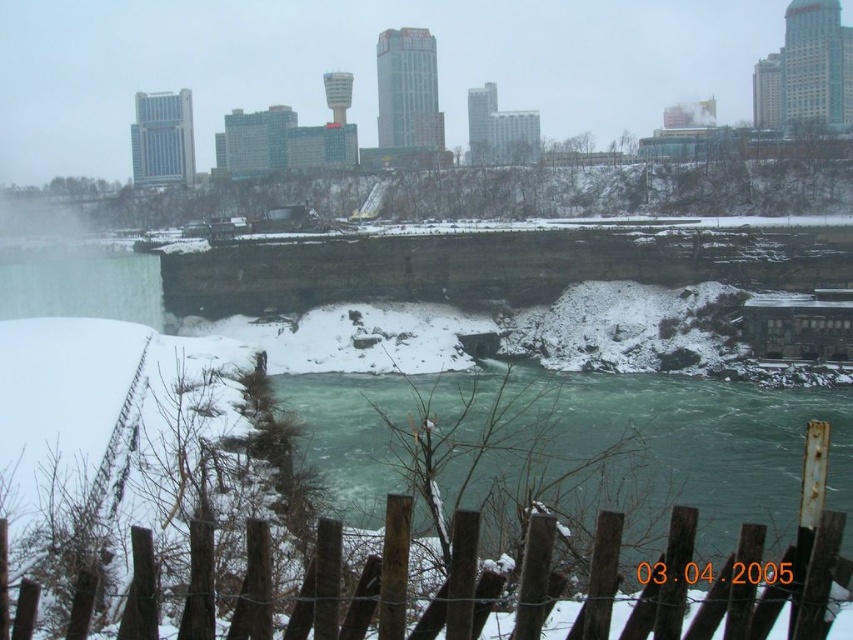
Who is shorter, green frothy water at center or wooden fence at lower center?

wooden fence at lower center is shorter.

Which is behind, point (610, 428) or point (254, 576)?

The point (610, 428) is more distant.

This screenshot has height=640, width=853. Find the location of `green frothy water at center`. green frothy water at center is located at coordinates (584, 445).